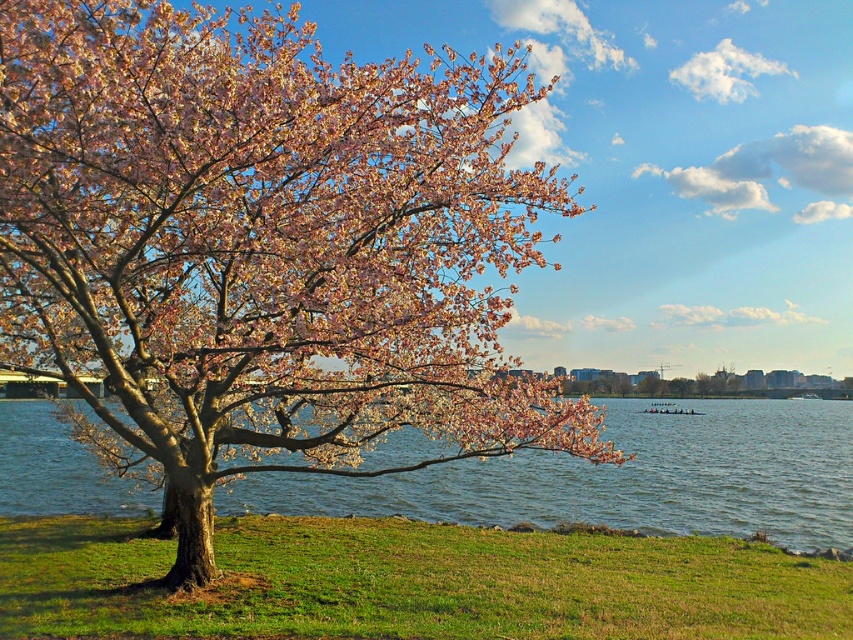
You are standing in the outdoor scene and want to take a photo of the pink bloom at center and the blue water at center. Which object will appear larger in the photo?

The pink bloom at center will appear larger in the photo because it is closer to the viewer than the blue water at center.